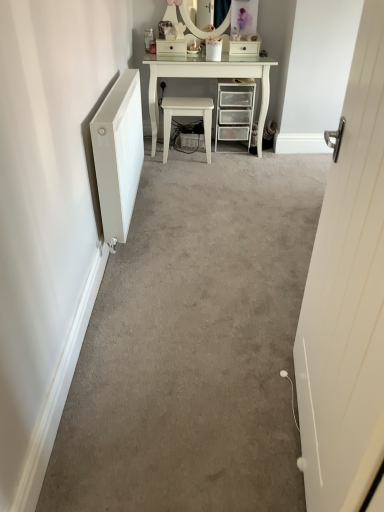
In order to click on free spot below white wooden door at right (from a real-world perspective) in this screenshot , I will do `click(296, 426)`.